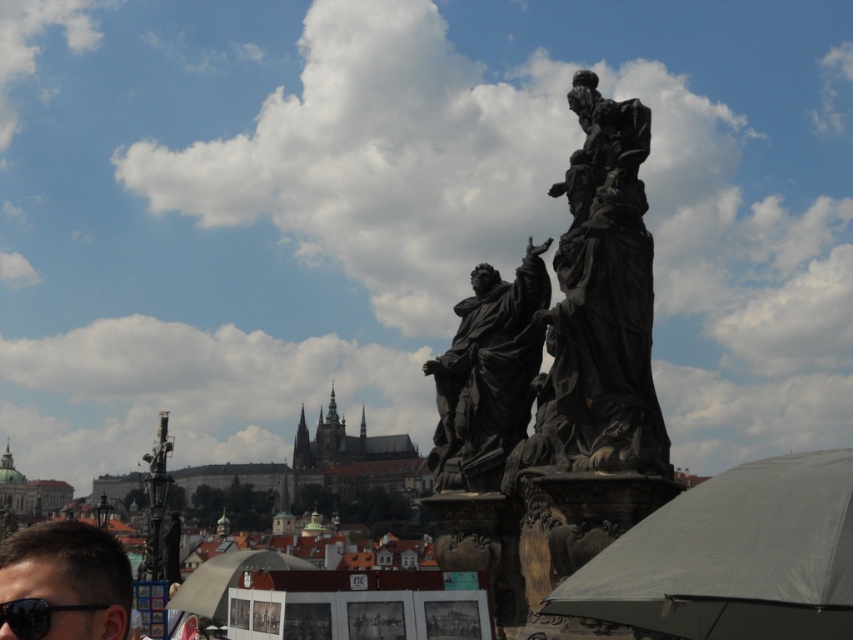
Does black stone statue at upper right appear on the right side of black plastic goggles at lower left?

Yes, black stone statue at upper right is to the right of black plastic goggles at lower left.

Does black stone statue at upper right have a lesser width compared to black plastic goggles at lower left?

Incorrect, black stone statue at upper right's width is not less than black plastic goggles at lower left's.

Is point (614, 205) more distant than point (12, 618)?

Yes, it is behind point (12, 618).

Locate an element on the screen. This screenshot has width=853, height=640. black stone statue at upper right is located at coordinates (599, 307).

Between point (641, 598) and point (54, 580), which one is positioned in front?

Positioned in front is point (641, 598).

Can you confirm if gray matte umbrella at lower right is positioned to the right of brown hair at lower left?

Indeed, gray matte umbrella at lower right is positioned on the right side of brown hair at lower left.

In order to click on gray matte umbrella at lower right in this screenshot , I will do `click(732, 557)`.

Locate an element on the screen. The width and height of the screenshot is (853, 640). gray matte umbrella at lower right is located at coordinates (732, 557).

In the scene shown: Is black stone statue at center bigger than white matte umbrella at lower center?

No.

Can you confirm if black stone statue at center is positioned to the right of white matte umbrella at lower center?

Yes, black stone statue at center is to the right of white matte umbrella at lower center.

Does point (427, 371) come in front of point (173, 600)?

Yes.

You are a GUI agent. You are given a task and a screenshot of the screen. Output one action in this format:
    pyautogui.click(x=<x>, y=<y>)
    Task: Click on the black stone statue at center
    
    Given the screenshot: What is the action you would take?
    pyautogui.click(x=488, y=374)